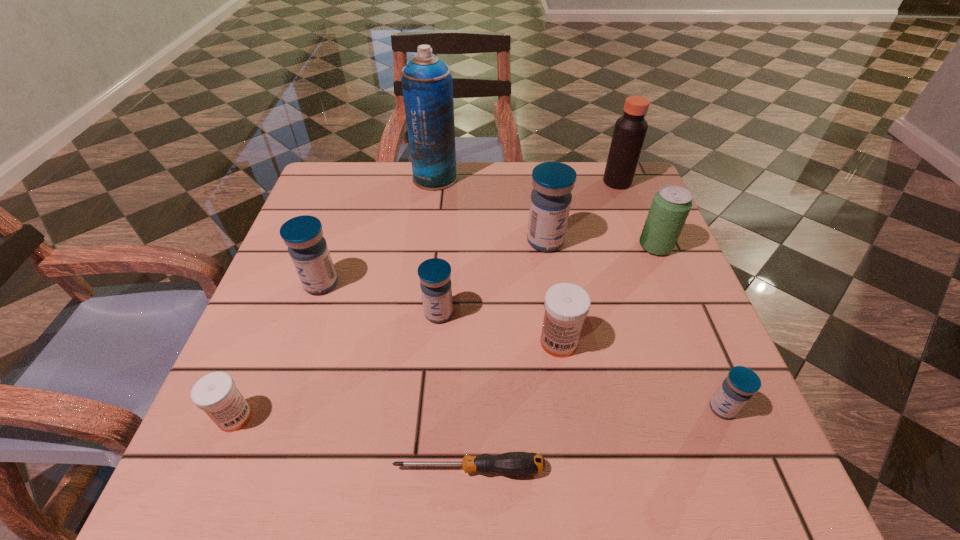
At what (x,y) coordinates should I click in order to perform the action: click on the fourth farthest medicine. Please return your answer as a coordinate pair (x, y). The width and height of the screenshot is (960, 540). Looking at the image, I should click on (566, 305).

Identify the location of the bigger white medicine. This screenshot has width=960, height=540. (566, 305).

Locate an element on the screen. the smaller white medicine is located at coordinates (216, 394).

This screenshot has height=540, width=960. In order to click on the left white medicine in this screenshot , I will do `click(216, 394)`.

Find the location of a particular element. The width and height of the screenshot is (960, 540). the rightmost blue medicine is located at coordinates (741, 383).

Identify the location of the rightmost medicine. (741, 383).

Locate an element on the screen. The width and height of the screenshot is (960, 540). screwdriver is located at coordinates (511, 463).

The image size is (960, 540). I want to click on the shortest object, so click(511, 463).

The height and width of the screenshot is (540, 960). Identify the location of free space located 0.310m on the front of the aerosol can. (422, 278).

Image resolution: width=960 pixels, height=540 pixels. In order to click on free space located 0.050m on the front of the vinegar in this screenshot , I will do pyautogui.click(x=625, y=202).